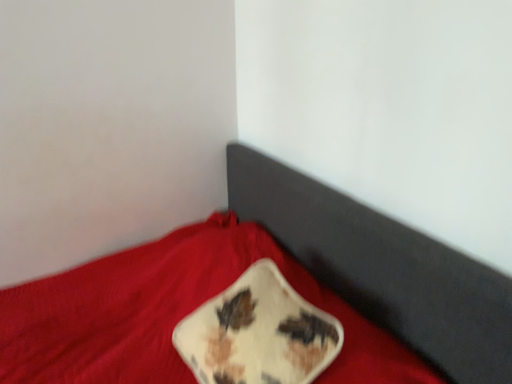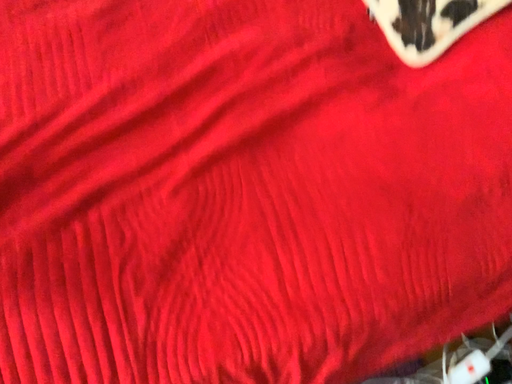
Question: Which way did the camera rotate in the video?

Choices:
 (A) rotated upward
 (B) rotated downward

Answer: (B)